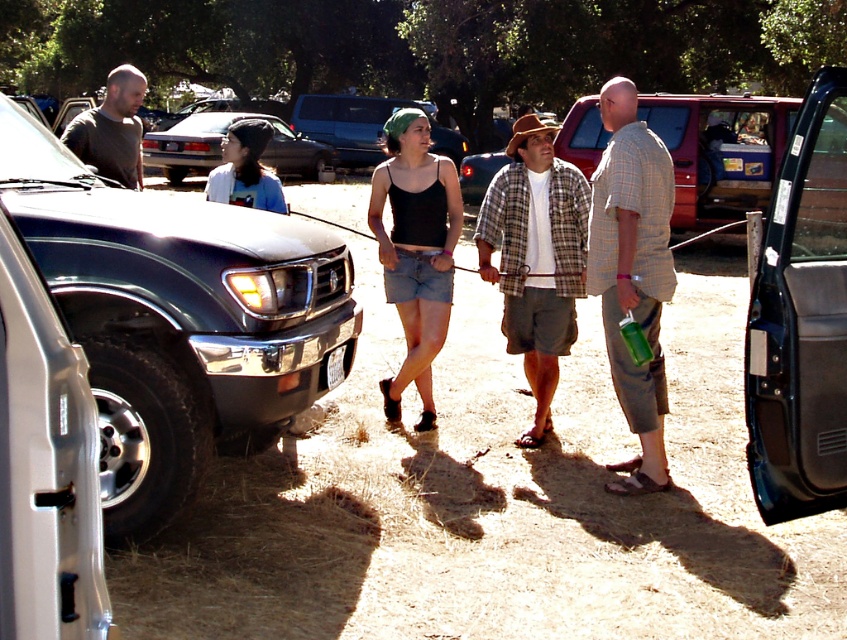
Does plaid fabric shirt at center have a lesser height compared to matte gray suv at center?

Correct, plaid fabric shirt at center is not as tall as matte gray suv at center.

Does point (547, 428) come in front of point (203, 124)?

Yes, point (547, 428) is in front of point (203, 124).

Where is `plaid fabric shirt at center`? This screenshot has width=847, height=640. plaid fabric shirt at center is located at coordinates (535, 257).

Between matte gray suv at center and matte black suv at center, which one appears on the right side from the viewer's perspective?

matte black suv at center

Does matte gray suv at center appear over matte black suv at center?

Incorrect, matte gray suv at center is not positioned above matte black suv at center.

Does point (172, 168) come farther from viewer compared to point (339, 100)?

No, (172, 168) is in front of (339, 100).

I want to click on matte gray suv at center, so click(220, 150).

Is plaid fabric shirt at center closer to the viewer compared to knit beanie at center?

Yes.

Does plaid fabric shirt at center come behind knit beanie at center?

No, it is in front of knit beanie at center.

This screenshot has width=847, height=640. What do you see at coordinates (535, 257) in the screenshot? I see `plaid fabric shirt at center` at bounding box center [535, 257].

This screenshot has height=640, width=847. In order to click on plaid fabric shirt at center in this screenshot , I will do `click(535, 257)`.